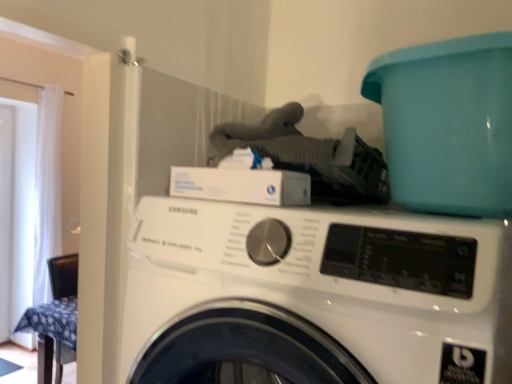
Question: Is white glossy screen door at left in front of or behind white glossy washing machine at center in the image?

Choices:
 (A) front
 (B) behind

Answer: (B)

Question: Does point (10, 253) appear closer or farther from the camera than point (246, 274)?

Choices:
 (A) farther
 (B) closer

Answer: (A)

Question: Which is nearer to the teal plastic bucket at upper right?

Choices:
 (A) white sheer curtain at left
 (B) white glossy screen door at left
 (C) white glossy washing machine at center

Answer: (C)

Question: Estimate the real-world distances between objects in this image. Which object is closer to the white glossy screen door at left?

Choices:
 (A) teal plastic bucket at upper right
 (B) white glossy washing machine at center
 (C) white sheer curtain at left

Answer: (C)